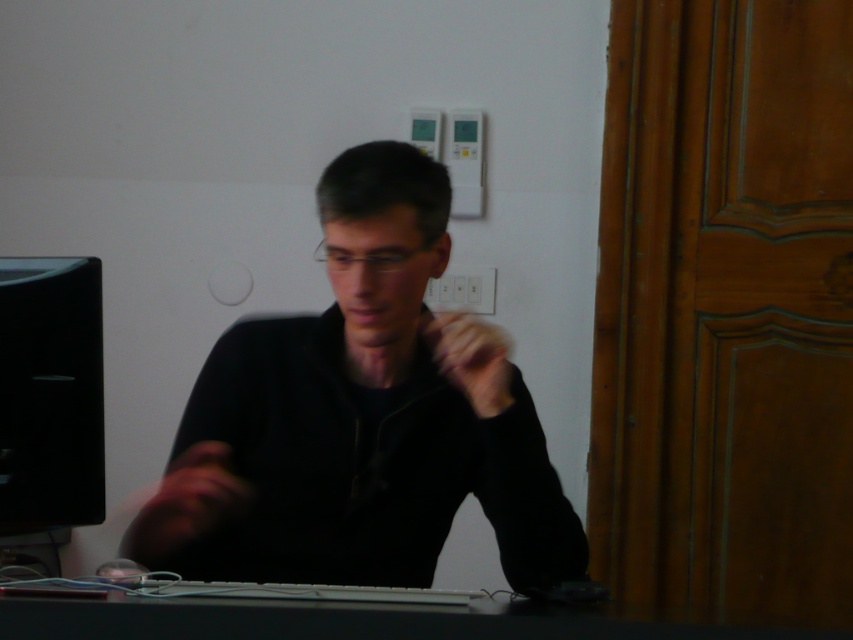
Does black glossy monitor at left appear over black plastic keyboard at lower center?

Yes.

Which is in front, point (3, 268) or point (38, 630)?

Point (38, 630) is in front.

Does point (67, 474) come farther from viewer compared to point (131, 596)?

That is True.

I want to click on black glossy monitor at left, so 49,406.

Measure the distance between point (445, 369) and camera.

A distance of 5.03 feet exists between point (445, 369) and camera.

Is point (178, 536) behind point (212, 611)?

Yes, it is behind point (212, 611).

Is point (138, 515) positioned before point (341, 628)?

No, (138, 515) is behind (341, 628).

Locate an element on the screen. This screenshot has width=853, height=640. black matte shirt at center is located at coordinates (360, 417).

Describe the element at coordinates (360, 417) in the screenshot. This screenshot has height=640, width=853. I see `black matte shirt at center` at that location.

Who is higher up, black matte shirt at center or black glossy monitor at left?

black matte shirt at center is above.

Where is `black matte shirt at center`? Image resolution: width=853 pixels, height=640 pixels. black matte shirt at center is located at coordinates (360, 417).